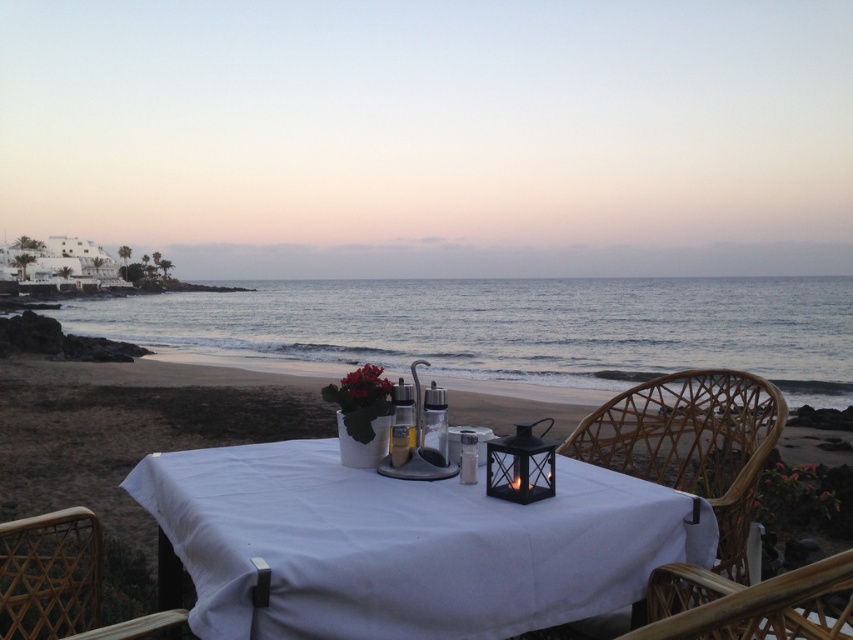
Question: Which object appears farthest from the camera in this image?

Choices:
 (A) white cloth-covered table at center
 (B) woven wood chair at lower left

Answer: (B)

Question: Can you confirm if white cloth-covered table at center is wider than woven wood chair at center?

Choices:
 (A) no
 (B) yes

Answer: (B)

Question: Is white cloth-covered table at center to the left of woven wood chair at lower left from the viewer's perspective?

Choices:
 (A) no
 (B) yes

Answer: (A)

Question: Which object is closer to the camera taking this photo?

Choices:
 (A) white cloth-covered table at center
 (B) woven wood chair at lower left
 (C) woven rattan chair at right

Answer: (A)

Question: Does woven rattan chair at right come behind woven wood chair at center?

Choices:
 (A) no
 (B) yes

Answer: (B)

Question: Estimate the real-world distances between objects in this image. Which object is closer to the woven rattan chair at right?

Choices:
 (A) white cloth-covered table at center
 (B) woven wood chair at center

Answer: (A)